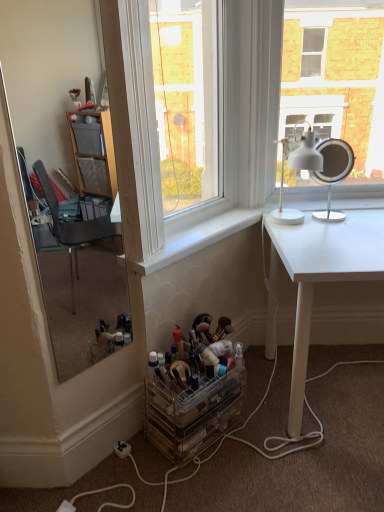
I want to click on unoccupied region to the right of white matte table lamp at upper right, the second table lamp positioned from the right, so click(343, 225).